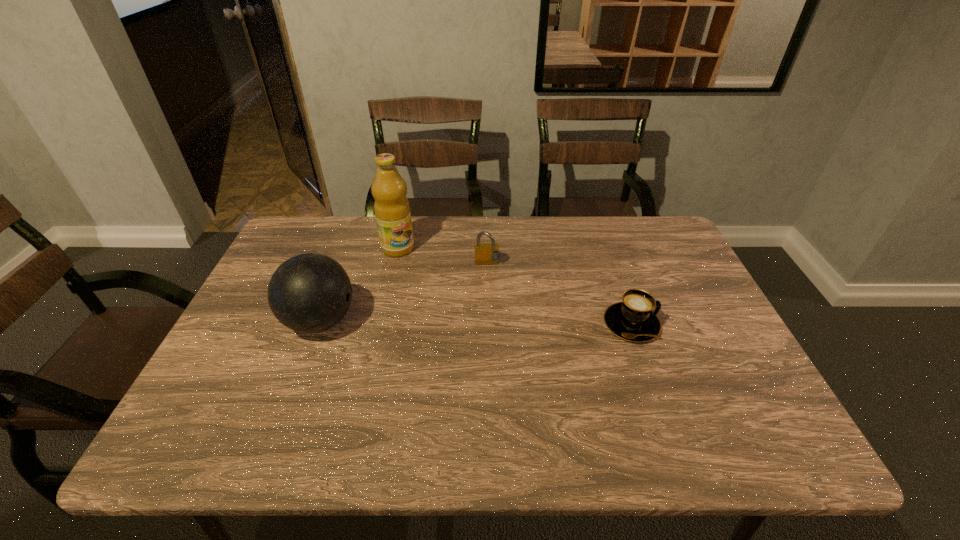
Image resolution: width=960 pixels, height=540 pixels. I want to click on vacant point located on the side with the combination dials of the third tallest object, so click(x=491, y=283).

Where is `free space located 0.060m on the side with the combination dials of the third tallest object`? Image resolution: width=960 pixels, height=540 pixels. free space located 0.060m on the side with the combination dials of the third tallest object is located at coordinates (491, 283).

At what (x,y) coordinates should I click in order to perform the action: click on free space located 0.080m on the side with the combination dials of the third tallest object. Please return your answer as a coordinate pair (x, y). The height and width of the screenshot is (540, 960). Looking at the image, I should click on (492, 288).

Identify the location of vacant position located 0.290m on the label of the third object from right to left. Image resolution: width=960 pixels, height=540 pixels. (452, 316).

The width and height of the screenshot is (960, 540). In order to click on free spot located on the label of the third object from right to left in this screenshot , I will do `click(450, 314)`.

Where is `vacant space located on the label of the third object from right to left`? vacant space located on the label of the third object from right to left is located at coordinates (412, 266).

This screenshot has width=960, height=540. Find the location of `padlock located in the far edge section of the desktop`. padlock located in the far edge section of the desktop is located at coordinates (485, 254).

Find the location of `olive oil that is at the far edge`. olive oil that is at the far edge is located at coordinates (391, 207).

Where is `object that is at the left edge`? The image size is (960, 540). object that is at the left edge is located at coordinates [x=309, y=293].

Identify the location of object positioned at the right edge. (633, 320).